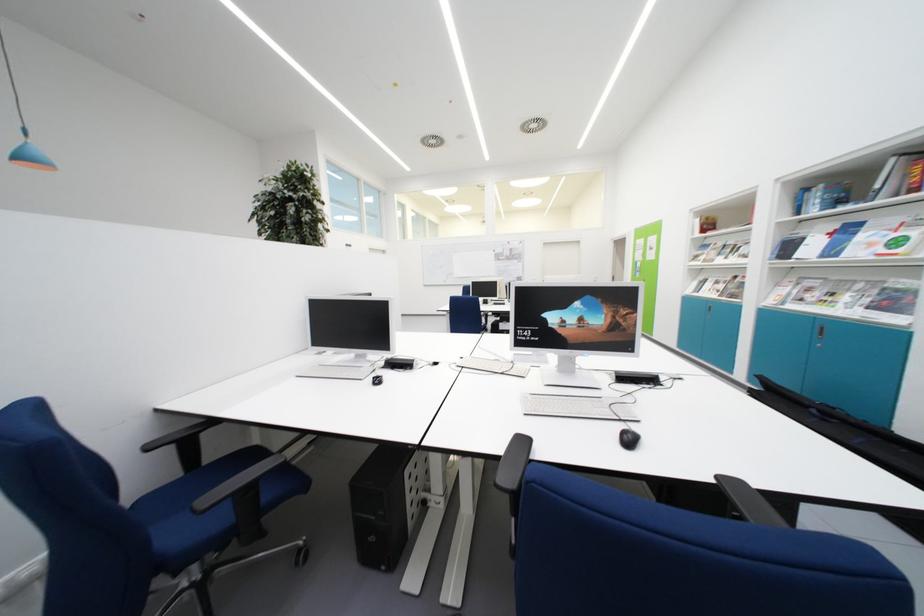
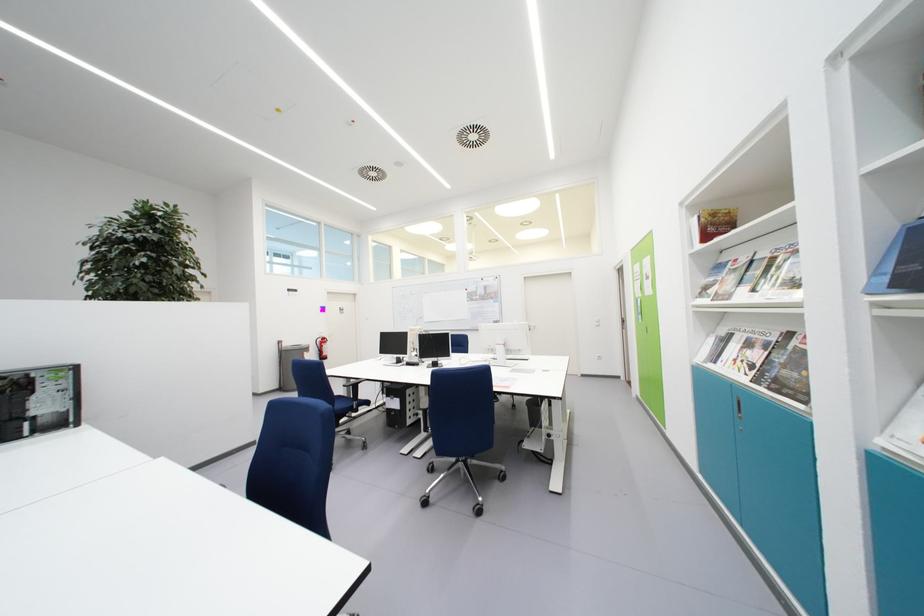
The point at (713,223) is marked in the first image. Where is the corresponding point in the second image?

(720, 217)